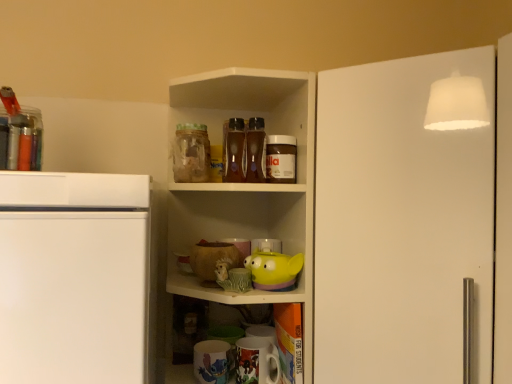
Question: Considering the relative sizes of smooth chocolate spread at upper center, which appears as the second beverage when viewed from the left, and matte green ceramic mug at center, positioned as the first toy in left-to-right order, in the image provided, is smooth chocolate spread at upper center, which appears as the second beverage when viewed from the left, smaller than matte green ceramic mug at center, positioned as the first toy in left-to-right order,?

Choices:
 (A) no
 (B) yes

Answer: (A)

Question: Can we say smooth chocolate spread at upper center, which appears as the second beverage when viewed from the left, lies outside matte green ceramic mug at center, positioned as the first toy in left-to-right order?

Choices:
 (A) yes
 (B) no

Answer: (A)

Question: Is smooth chocolate spread at upper center, the first beverage viewed from the right, behind matte green ceramic mug at center, positioned as the first toy in left-to-right order?

Choices:
 (A) no
 (B) yes

Answer: (B)

Question: Can you confirm if smooth chocolate spread at upper center, which appears as the second beverage when viewed from the left, is wider than matte green ceramic mug at center, positioned as the 2th toy in right-to-left order?

Choices:
 (A) yes
 (B) no

Answer: (B)

Question: Could you tell me if smooth chocolate spread at upper center, which appears as the second beverage when viewed from the left, is facing matte green ceramic mug at center, positioned as the 2th toy in right-to-left order?

Choices:
 (A) no
 (B) yes

Answer: (A)

Question: Considering their positions, is yellow rubber duck at center, the 1th toy from the right, located in front of or behind matte green ceramic mug at center, positioned as the 2th toy in right-to-left order?

Choices:
 (A) behind
 (B) front

Answer: (A)

Question: Is yellow rubber duck at center, arranged as the 2th toy when viewed from the left, to the left or to the right of matte green ceramic mug at center, positioned as the 2th toy in right-to-left order, in the image?

Choices:
 (A) right
 (B) left

Answer: (A)

Question: From a real-world perspective, relative to matte green ceramic mug at center, positioned as the first toy in left-to-right order, is yellow rubber duck at center, the 1th toy from the right, vertically above or below?

Choices:
 (A) below
 (B) above

Answer: (B)

Question: From the image's perspective, is yellow rubber duck at center, arranged as the 2th toy when viewed from the left, positioned above or below matte green ceramic mug at center, positioned as the 2th toy in right-to-left order?

Choices:
 (A) above
 (B) below

Answer: (A)

Question: From the image's perspective, is matte ceramic mug at lower center, arranged as the second appliance when viewed from the right, above or below matte ceramic mug at lower center, acting as the first appliance starting from the right?

Choices:
 (A) below
 (B) above

Answer: (A)

Question: Is matte ceramic mug at lower center, which is the 1th appliance from left to right, wider or thinner than matte ceramic mug at lower center, acting as the first appliance starting from the right?

Choices:
 (A) thin
 (B) wide

Answer: (B)

Question: From a real-world perspective, relative to matte ceramic mug at lower center, acting as the first appliance starting from the right, is matte ceramic mug at lower center, arranged as the second appliance when viewed from the right, vertically above or below?

Choices:
 (A) below
 (B) above

Answer: (A)

Question: Is matte ceramic mug at lower center, which is the 1th appliance from left to right, to the left or to the right of matte ceramic mug at lower center, which appears as the 2th appliance when viewed from the left, in the image?

Choices:
 (A) right
 (B) left

Answer: (B)

Question: Would you say white matte door at upper right is to the left or to the right of matte green ceramic mug at center, positioned as the 2th toy in right-to-left order, in the picture?

Choices:
 (A) left
 (B) right

Answer: (B)

Question: Is white matte door at upper right bigger or smaller than matte green ceramic mug at center, positioned as the first toy in left-to-right order?

Choices:
 (A) small
 (B) big

Answer: (B)